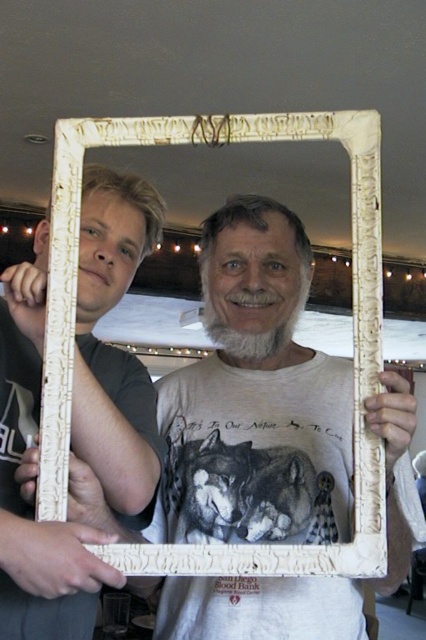
Question: Does matte white frame at left appear over white wood picture frame at center?

Choices:
 (A) yes
 (B) no

Answer: (B)

Question: Which object is farther from the camera taking this photo?

Choices:
 (A) matte white frame at left
 (B) white wood picture frame at center

Answer: (B)

Question: Is matte white frame at left positioned in front of white wood picture frame at center?

Choices:
 (A) yes
 (B) no

Answer: (A)

Question: Which point is farther from the camera taking this photo?

Choices:
 (A) (365, 275)
 (B) (34, 376)

Answer: (B)

Question: Among these objects, which one is nearest to the camera?

Choices:
 (A) matte white frame at left
 (B) white wood picture frame at center

Answer: (A)

Question: Does matte white frame at left have a lesser width compared to white wood picture frame at center?

Choices:
 (A) yes
 (B) no

Answer: (A)